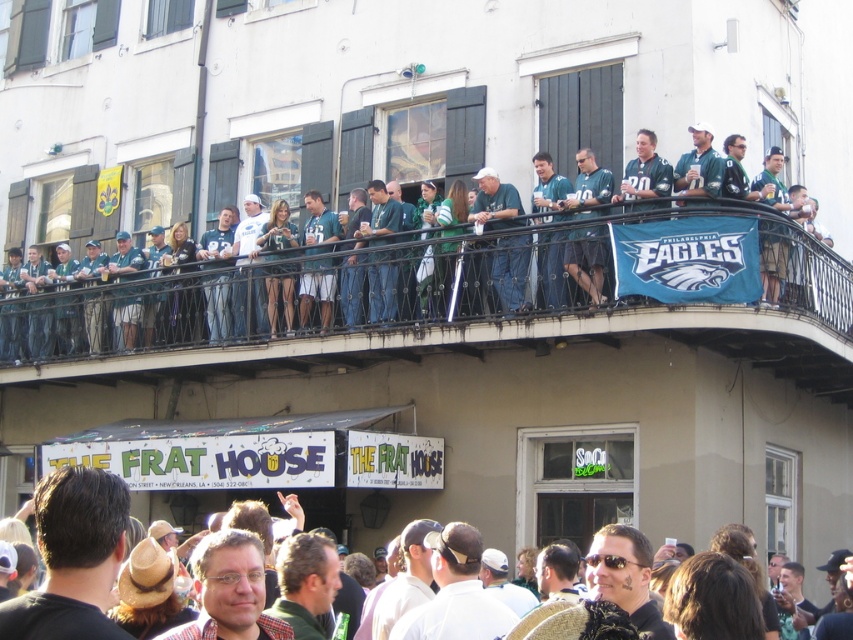
Question: Which of the following is the closest to the observer?

Choices:
 (A) dark brown leather jacket at center
 (B) matte green jersey at center

Answer: (A)

Question: Which point appears closest to the camera in this image?

Choices:
 (A) (91, 540)
 (B) (122, 278)

Answer: (A)

Question: Can you confirm if matte green jersey at center is positioned above dark brown leather jacket at center?

Choices:
 (A) no
 (B) yes

Answer: (B)

Question: Is matte green jersey at center further to the viewer compared to dark brown leather jacket at center?

Choices:
 (A) yes
 (B) no

Answer: (A)

Question: Can you confirm if matte green jersey at center is thinner than dark brown leather jacket at center?

Choices:
 (A) no
 (B) yes

Answer: (A)

Question: Which point appears farthest from the camera in this image?

Choices:
 (A) (84, 520)
 (B) (68, 307)

Answer: (B)